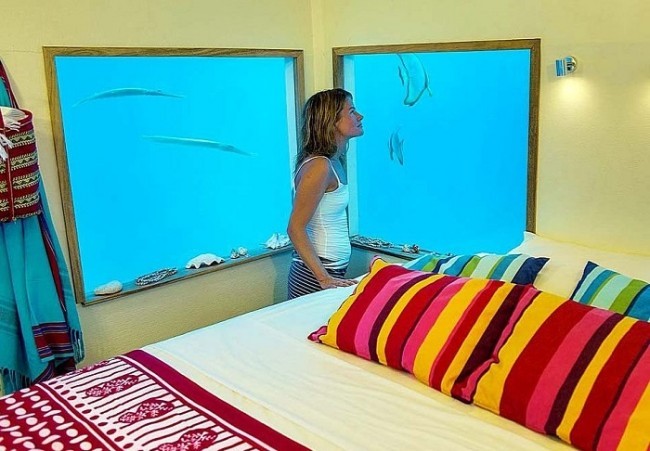
Identify the location of windows. The image size is (650, 451). (400, 91), (237, 102).